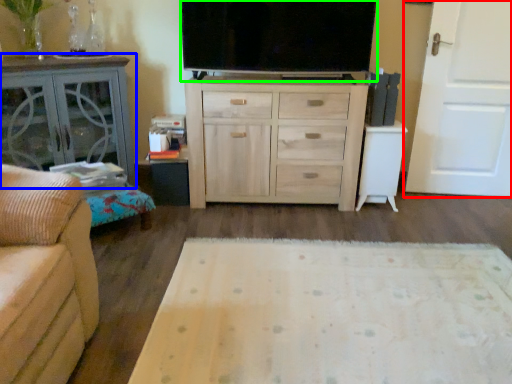
Question: Which object is the farthest from door (highlighted by a red box)? Choose among these: table (highlighted by a blue box) or television (highlighted by a green box).

Choices:
 (A) table
 (B) television

Answer: (A)